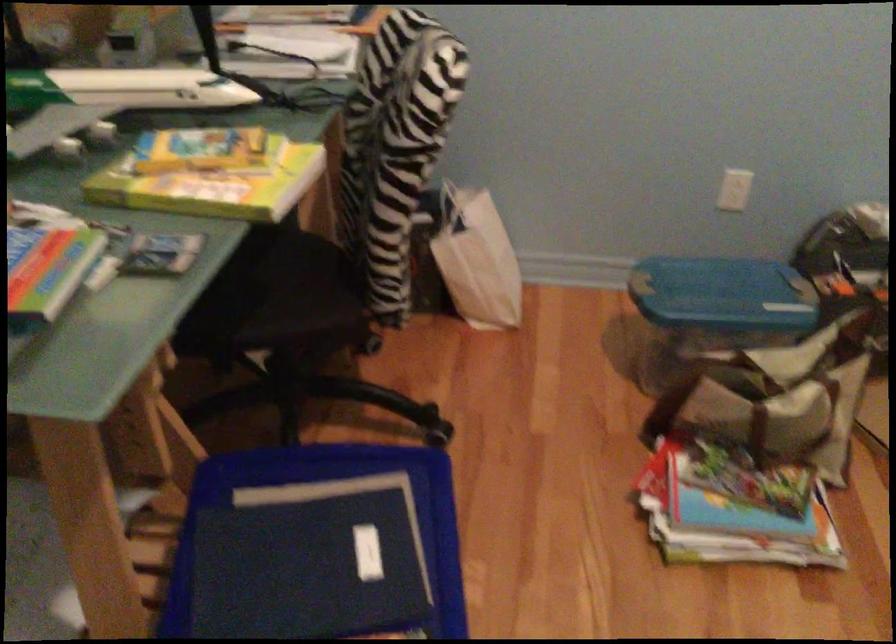
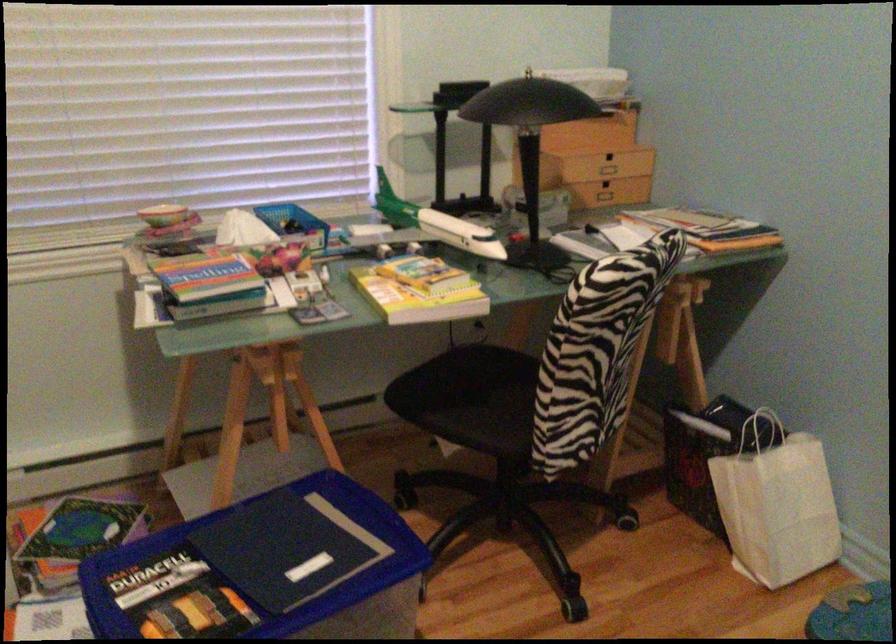
In the second image, find the point that corresponds to pixel 234 268 in the first image.

(487, 377)